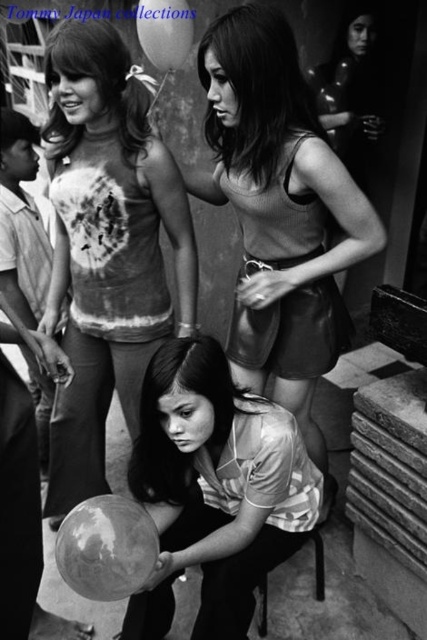
Question: Which point is closer to the camera taking this photo?

Choices:
 (A) (195, 426)
 (B) (251, 211)

Answer: (A)

Question: Is striped fabric blouse at center above metallic black chair at lower center?

Choices:
 (A) no
 (B) yes

Answer: (B)

Question: Which point is farther from the camera taking this photo?

Choices:
 (A) (221, 488)
 (B) (310, 246)

Answer: (B)

Question: Which object appears closest to the camera in this image?

Choices:
 (A) striped fabric blouse at center
 (B) metallic black chair at lower center
 (C) tie-dye fabric shirt at upper left

Answer: (A)

Question: Does matte black tank top at center appear on the left side of striped fabric blouse at center?

Choices:
 (A) no
 (B) yes

Answer: (A)

Question: Is the position of striped fabric blouse at center more distant than that of metallic black chair at lower center?

Choices:
 (A) no
 (B) yes

Answer: (A)